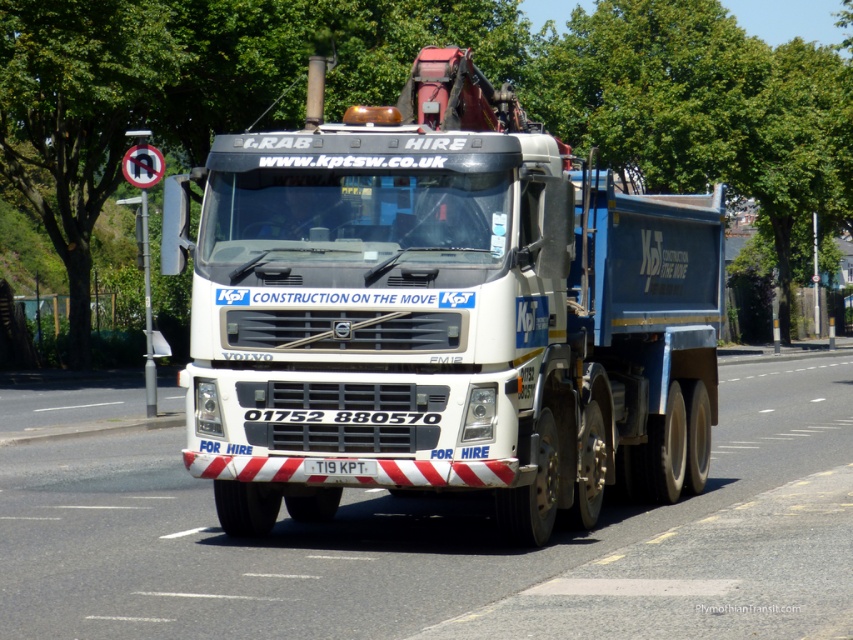
You are a delivery driver who needs to park the white metallic truck at center under the green leafy tree at upper center for shade. Is the truck currently positioned under the tree?

The white metallic truck at center is below green leafy tree at upper center, so yes, the truck is currently positioned under the tree.

Looking at this image, you are a truck driver planning to park the Volvo FM12 truck near the green leafy tree at upper center and the green leafy tree at upper left. Which tree requires more space to accommodate its width when parking?

The green leafy tree at upper center requires more space because its width surpasses that of the green leafy tree at upper left.

You are standing in front of a Volvo FM12 truck with a crane. The truck has a registration plate and a phone number on it. There is a point marked at coordinates (442,314). What object is located at this point?

The point at coordinates (442,314) indicates the white metallic truck at center.